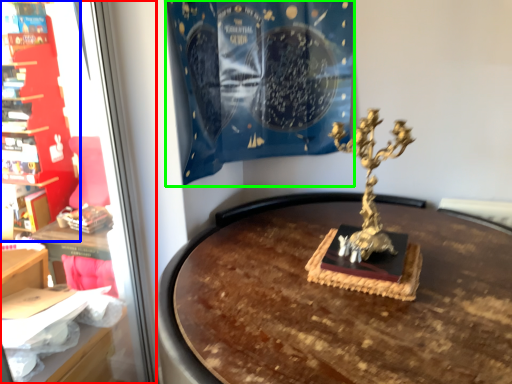
Question: Which object is the farthest from shop window (highlighted by a red box)? Choose among these: furniture (highlighted by a blue box) or curtain (highlighted by a green box).

Choices:
 (A) furniture
 (B) curtain

Answer: (B)